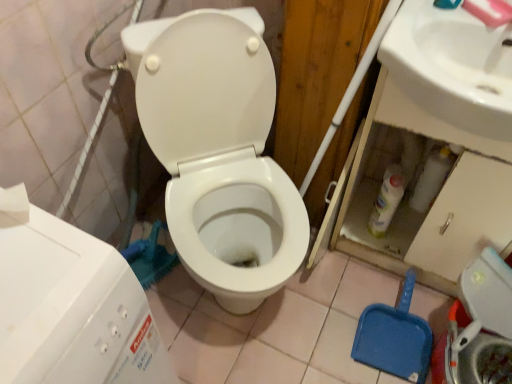
Question: From the image's perspective, is white glossy toilet at center over white plastic water tank at lower left?

Choices:
 (A) no
 (B) yes

Answer: (B)

Question: From a real-world perspective, is white glossy toilet at center positioned under white plastic water tank at lower left based on gravity?

Choices:
 (A) yes
 (B) no

Answer: (A)

Question: Can you confirm if white glossy toilet at center is shorter than white plastic water tank at lower left?

Choices:
 (A) yes
 (B) no

Answer: (B)

Question: Is white glossy toilet at center further to camera compared to white plastic water tank at lower left?

Choices:
 (A) yes
 (B) no

Answer: (A)

Question: From a real-world perspective, is white glossy toilet at center positioned over white plastic water tank at lower left based on gravity?

Choices:
 (A) no
 (B) yes

Answer: (A)

Question: Is white glossy toilet at center facing towards white plastic water tank at lower left?

Choices:
 (A) no
 (B) yes

Answer: (A)

Question: Is white glossy sink at upper right behind white plastic water tank at lower left?

Choices:
 (A) no
 (B) yes

Answer: (B)

Question: Considering the relative sizes of white glossy sink at upper right and white plastic water tank at lower left in the image provided, is white glossy sink at upper right bigger than white plastic water tank at lower left?

Choices:
 (A) no
 (B) yes

Answer: (A)

Question: Is there a large distance between white glossy sink at upper right and white plastic water tank at lower left?

Choices:
 (A) yes
 (B) no

Answer: (B)

Question: Is white glossy sink at upper right positioned with its back to white plastic water tank at lower left?

Choices:
 (A) no
 (B) yes

Answer: (A)

Question: Considering the relative sizes of white glossy sink at upper right and white plastic water tank at lower left in the image provided, is white glossy sink at upper right taller than white plastic water tank at lower left?

Choices:
 (A) yes
 (B) no

Answer: (B)

Question: Is white plastic water tank at lower left completely or partially inside white glossy sink at upper right?

Choices:
 (A) yes
 (B) no

Answer: (B)

Question: Does white glossy toilet at center lie in front of white glossy sink at upper right?

Choices:
 (A) no
 (B) yes

Answer: (B)